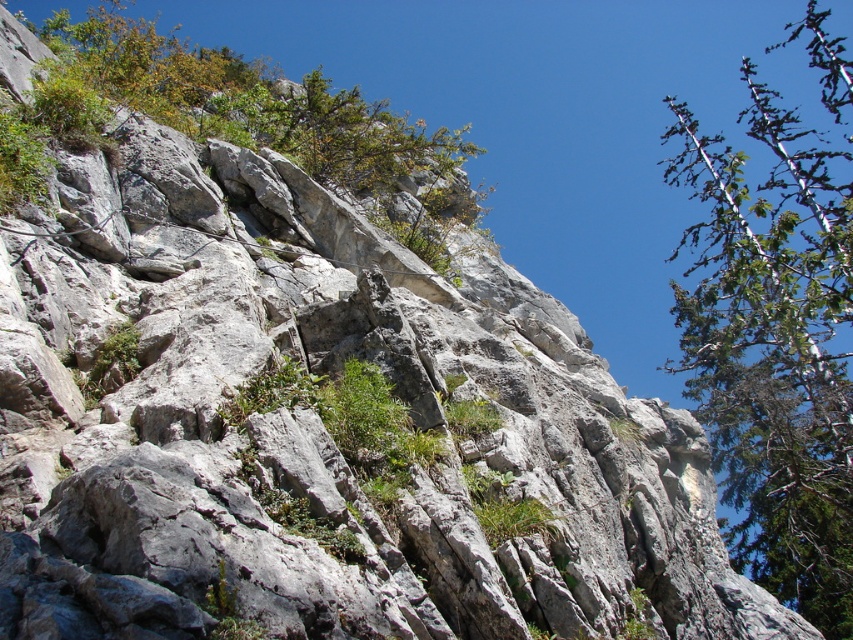
Based on the photo, you are a hiker trying to navigate between two green leafy trees. The path you want to take is between the green leafy tree at upper right and the green leafy tree at upper left. If your backpack is 1.2 meters wide, will it fit through the space between them?

The green leafy tree at upper right is wider than the green leafy tree at upper left. However, the width of the trees themselves does not directly indicate the width of the path between them. The question does not provide information about the distance between the two trees, so it is impossible to determine if the backpack will fit through the space.

You are standing at the base of the cliff and want to reach the green leafy tree at upper right. Which direction should you look to find it?

The green leafy tree at upper right is located at point (776, 332), so you should look towards the upper right direction to find it.